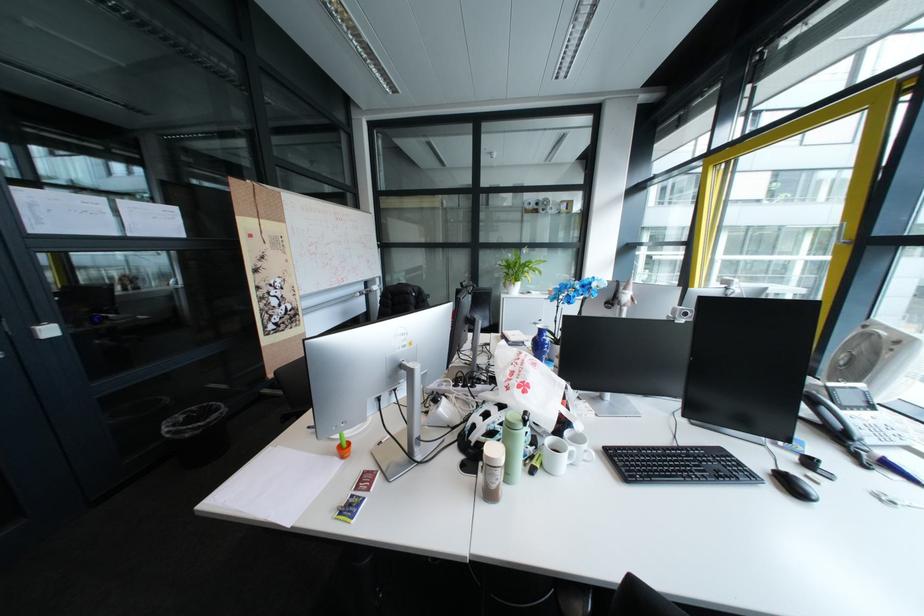
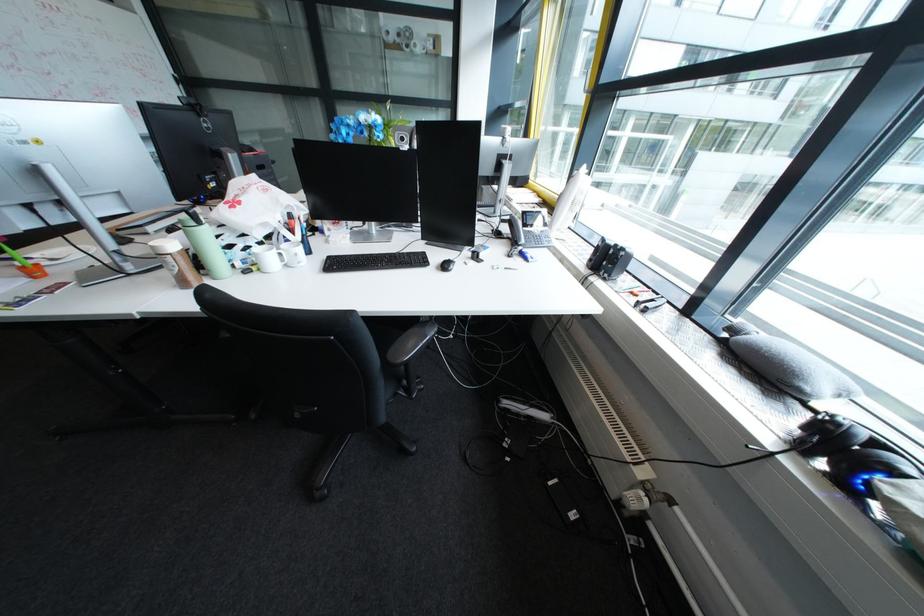
The images are taken continuously from a first-person perspective. In which direction are you moving?

The movement direction of the cameraman is right, backward.